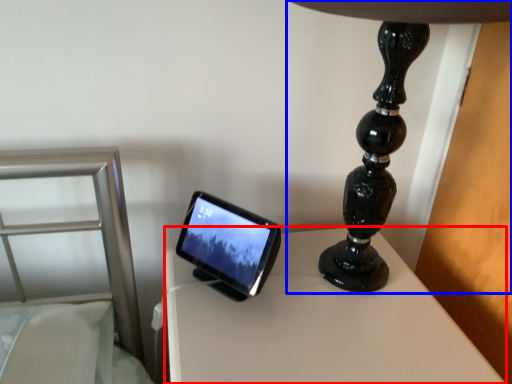
Question: Which object appears closest to the camera in this image, table (highlighted by a red box) or lamp (highlighted by a blue box)?

Choices:
 (A) table
 (B) lamp

Answer: (B)